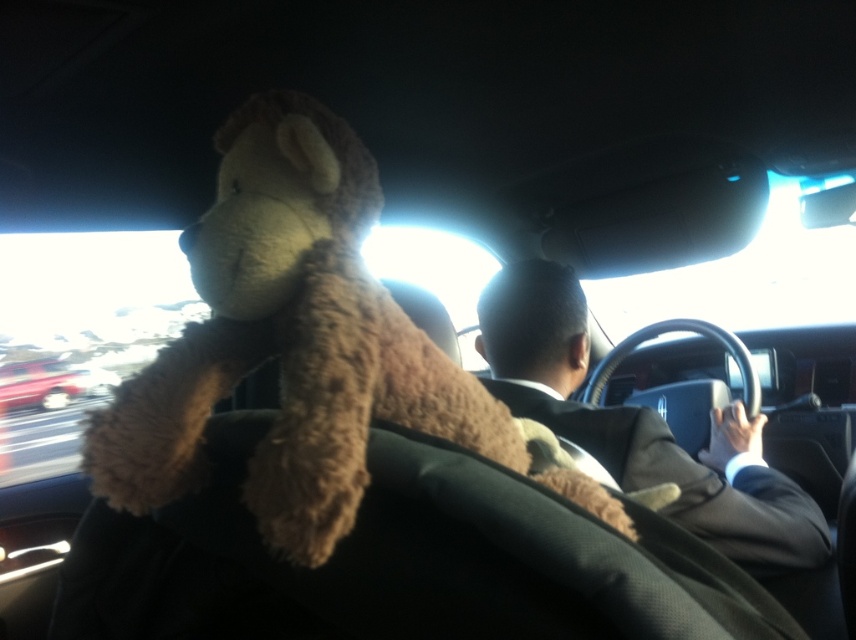
Is dark brown suit at center to the left of metallic red car at left from the viewer's perspective?

In fact, dark brown suit at center is to the right of metallic red car at left.

Who is more forward, (747, 554) or (21, 404)?

Point (747, 554)

You are a GUI agent. You are given a task and a screenshot of the screen. Output one action in this format:
    pyautogui.click(x=<x>, y=<y>)
    Task: Click on the dark brown suit at center
    
    Given the screenshot: What is the action you would take?
    pyautogui.click(x=642, y=428)

Who is positioned more to the right, brown plush toy at center or metallic red car at left?

brown plush toy at center

Who is lower down, brown plush toy at center or metallic red car at left?

Positioned lower is metallic red car at left.

Locate an element on the screen. The width and height of the screenshot is (856, 640). brown plush toy at center is located at coordinates (298, 346).

Does brown plush toy at center appear on the right side of dark brown suit at center?

Incorrect, brown plush toy at center is not on the right side of dark brown suit at center.

Between brown plush toy at center and dark brown suit at center, which one has less height?

brown plush toy at center is shorter.

Is point (548, 483) farther from camera compared to point (498, 385)?

No, it is in front of (498, 385).

Where is `brown plush toy at center`? This screenshot has height=640, width=856. brown plush toy at center is located at coordinates (298, 346).